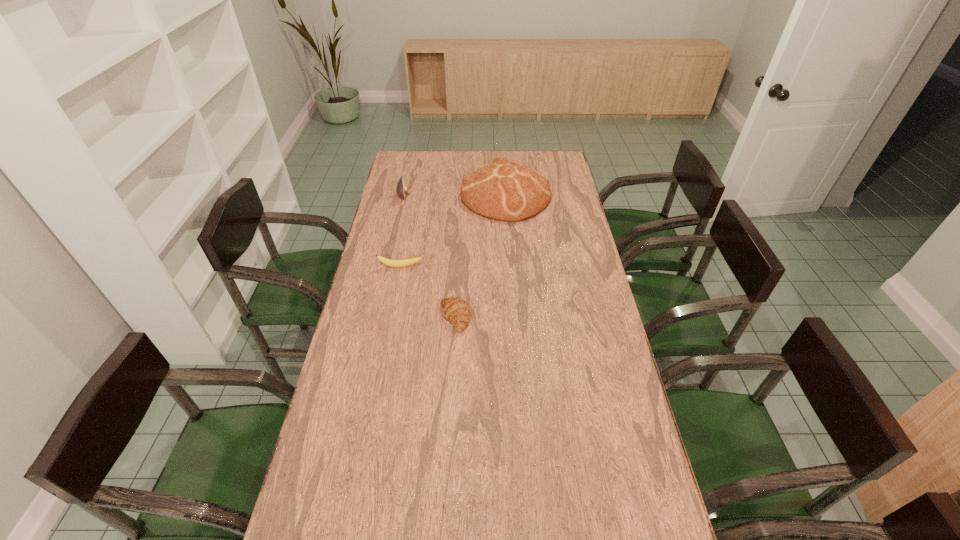
Locate an element on the screen. This screenshot has height=540, width=960. free space between the avocado and the nearest object is located at coordinates (429, 256).

Where is `empty space between the avocado and the crescent roll`? The width and height of the screenshot is (960, 540). empty space between the avocado and the crescent roll is located at coordinates (429, 256).

I want to click on empty space that is in between the tallest object and the crescent roll, so click(480, 256).

The image size is (960, 540). Find the location of `free space between the tallest object and the nearest object`. free space between the tallest object and the nearest object is located at coordinates (480, 256).

Image resolution: width=960 pixels, height=540 pixels. Identify the location of free space between the banana and the nearest object. tap(428, 292).

Find the location of `free spot between the crescent roll and the avocado`. free spot between the crescent roll and the avocado is located at coordinates (429, 256).

Where is `object that ranks as the third closest to the crescent roll`? The height and width of the screenshot is (540, 960). object that ranks as the third closest to the crescent roll is located at coordinates (401, 189).

Identify the location of object that stands as the closest to the bread. This screenshot has width=960, height=540. (401, 189).

At what (x,y) coordinates should I click in order to perform the action: click on free space that satisfies the following two spatial constraints: 1. on the front side of the bread; 2. on the seed side of the avocado. Please return your answer as a coordinate pair (x, y). The height and width of the screenshot is (540, 960). Looking at the image, I should click on (506, 195).

At what (x,y) coordinates should I click in order to perform the action: click on vacant area that satisfies the following two spatial constraints: 1. on the seed side of the crescent roll; 2. on the right side of the third shortest object. Please return your answer as a coordinate pair (x, y). The height and width of the screenshot is (540, 960). Looking at the image, I should click on (377, 318).